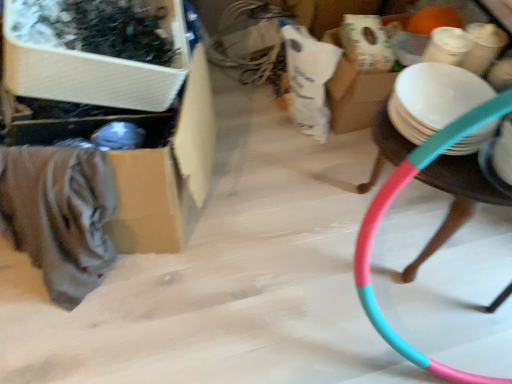
At what (x,y) coordinates should I click in order to perform the action: click on empty space that is in between pink plastic hoop at right and cardboard box at left, the first storage box in the back-to-front sequence. Please return your answer as a coordinate pair (x, y). The height and width of the screenshot is (384, 512). Looking at the image, I should click on (274, 197).